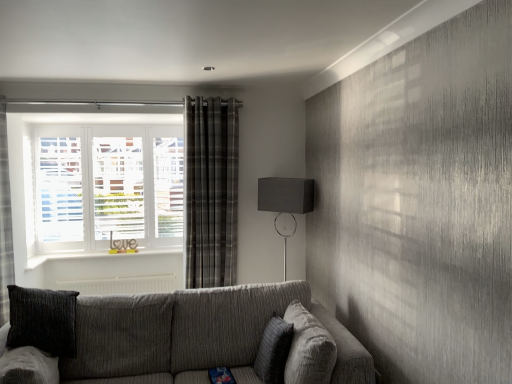
Question: Considering the relative positions of plaid fabric curtain at center and matte black lampshade at upper right in the image provided, is plaid fabric curtain at center to the left or to the right of matte black lampshade at upper right?

Choices:
 (A) right
 (B) left

Answer: (B)

Question: Considering the positions of plaid fabric curtain at center and matte black lampshade at upper right in the image, is plaid fabric curtain at center taller or shorter than matte black lampshade at upper right?

Choices:
 (A) short
 (B) tall

Answer: (B)

Question: Which object is positioned closest to the textured gray couch at lower center?

Choices:
 (A) textured gray pillow at center
 (B) plaid fabric curtain at center
 (C) metallic curtain rod at upper center
 (D) matte black lampshade at upper right

Answer: (A)

Question: Based on their relative distances, which object is nearer to the matte black lampshade at upper right?

Choices:
 (A) metallic curtain rod at upper center
 (B) plaid fabric curtain at center
 (C) textured gray couch at lower center
 (D) textured gray pillow at center

Answer: (B)